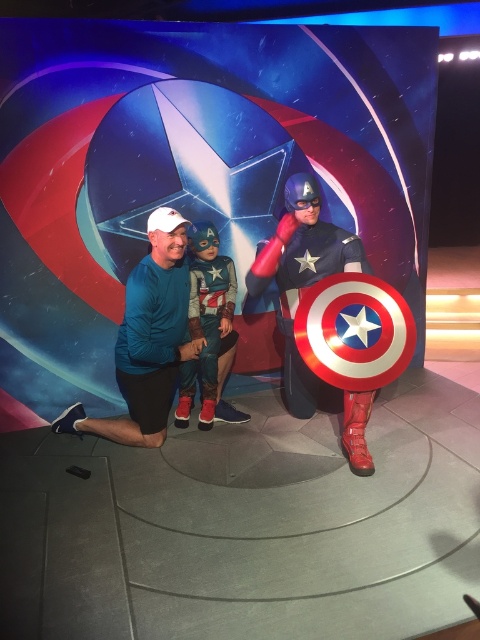
In the scene with the blue fabric shirt at center and the shiny metallic captain america shield at center, which object is positioned to the right of the other?

The shiny metallic captain america shield at center is to the right of the blue fabric shirt at center.

You are a photographer trying to capture a clear shot of both the blue fabric shirt at center and the shiny metallic captain america shield at center. Which object will appear larger in your photo?

The blue fabric shirt at center will appear larger in the photo because it is closer to the viewer than the shiny metallic captain america shield at center.